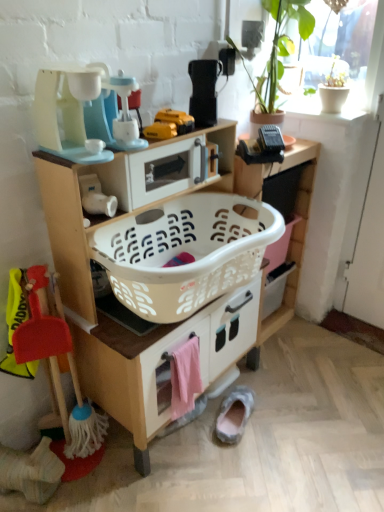
Question: Can you confirm if white plastic laundry basket at center is thinner than matte plastic toy coffee maker at upper left, the third appliance viewed from the right?

Choices:
 (A) yes
 (B) no

Answer: (B)

Question: From the image's perspective, is white plastic laundry basket at center below matte plastic toy coffee maker at upper left, the first appliance viewed from the left?

Choices:
 (A) no
 (B) yes

Answer: (B)

Question: From a real-world perspective, does white plastic laundry basket at center stand above matte plastic toy coffee maker at upper left, the first appliance viewed from the left?

Choices:
 (A) yes
 (B) no

Answer: (B)

Question: From the image's perspective, would you say white plastic laundry basket at center is positioned over matte plastic toy coffee maker at upper left, the third appliance viewed from the right?

Choices:
 (A) no
 (B) yes

Answer: (A)

Question: Is white plastic laundry basket at center taller than matte plastic toy coffee maker at upper left, the third appliance viewed from the right?

Choices:
 (A) no
 (B) yes

Answer: (B)

Question: Considering their positions, is white plastic laundry basket at center located in front of or behind yellow plastic toy at center, which is counted as the first toy, starting from the right?

Choices:
 (A) front
 (B) behind

Answer: (A)

Question: Based on their sizes in the image, would you say white plastic laundry basket at center is bigger or smaller than yellow plastic toy at center, which ranks as the 3th toy in left-to-right order?

Choices:
 (A) big
 (B) small

Answer: (A)

Question: From a real-world perspective, is white plastic laundry basket at center positioned above or below yellow plastic toy at center, which is counted as the first toy, starting from the right?

Choices:
 (A) below
 (B) above

Answer: (A)

Question: Is point (145, 425) positioned closer to the camera than point (152, 130)?

Choices:
 (A) farther
 (B) closer

Answer: (A)

Question: Based on their sizes in the image, would you say yellow plastic toy at center, the first toy in the top-to-bottom sequence, is bigger or smaller than white matte pot at upper right?

Choices:
 (A) big
 (B) small

Answer: (B)

Question: From the image's perspective, is yellow plastic toy at center, which is counted as the first toy, starting from the right, above or below white matte pot at upper right?

Choices:
 (A) below
 (B) above

Answer: (A)

Question: Does point pos(175,131) appear closer or farther from the camera than point pos(319,73)?

Choices:
 (A) closer
 (B) farther

Answer: (A)

Question: In the image, is yellow plastic toy at center, the 3th toy when ordered from bottom to top, on the left side or the right side of white matte pot at upper right?

Choices:
 (A) left
 (B) right

Answer: (A)

Question: Would you say pink fabric towel at lower center is to the left or to the right of black plastic toaster at upper center, the 1th appliance when ordered from right to left, in the picture?

Choices:
 (A) right
 (B) left

Answer: (B)

Question: From the image's perspective, is pink fabric towel at lower center above or below black plastic toaster at upper center, the 1th appliance when ordered from right to left?

Choices:
 (A) above
 (B) below

Answer: (B)